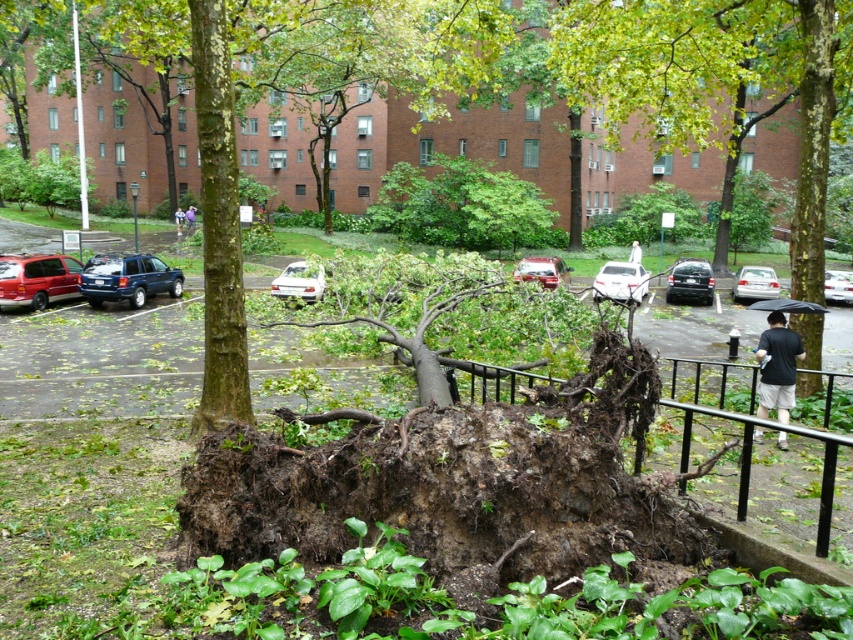
You are a delivery driver who needs to park your blue metallic suv at center in a spot that is not obstructed by debris. Based on the scene description, is the area around point (126, 278) clear enough for parking?

The blue metallic suv at center is located at point (126, 278), so the area around this point is clear enough for parking since it is where the suv is already parked.

Wait, the objects are the same? Let me check the input again. The user provided two objects that are identical. That might be a mistake. Let me see the original input again. The user wrote under Objects section as silver metallic sedan at center and metallic silver sedan at center. Maybe it was a typo where they meant different objects but repeated the same label. Since the objects are the same, the question can not be formed as per the rules. I need to inform the user about this inconsistency. However, the

The objects listed are identical, so a valid question cannot be generated. Please ensure the objects are distinct.

You are a delivery driver needing to park your vehicle, which is 5 meters long, between the blue metallic suv at center and the metallic silver sedan at center. Is there enough space for your vehicle?

The distance between the blue metallic suv at center and the metallic silver sedan at center is 14.22 meters. Since your vehicle is 5 meters long, there is sufficient space to park between them.